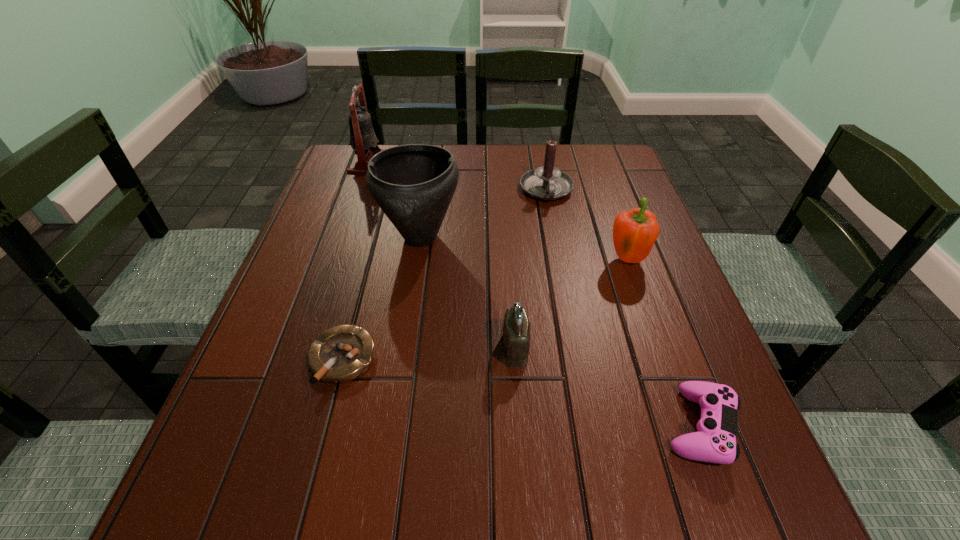
In order to click on bell in this screenshot , I will do `click(363, 140)`.

This screenshot has width=960, height=540. Find the location of `urn`. urn is located at coordinates (413, 184).

At what (x,y) coordinates should I click in order to perform the action: click on pepper. Please return your answer as a coordinate pair (x, y). The image size is (960, 540). Looking at the image, I should click on (635, 231).

Where is `the fifth object from left to right`? This screenshot has width=960, height=540. the fifth object from left to right is located at coordinates (547, 182).

This screenshot has width=960, height=540. What are the coordinates of `the third shortest object` in the screenshot? It's located at coord(516,328).

Where is `the fourth object from left to right`? the fourth object from left to right is located at coordinates (516, 328).

Identify the location of the sixth tallest object. tap(715, 442).

At what (x,y) coordinates should I click in order to perform the action: click on the shortest object. Please return your answer as a coordinate pair (x, y). Image resolution: width=960 pixels, height=540 pixels. Looking at the image, I should click on (343, 353).

Where is `vacant space situated 0.050m on the front of the bell`? This screenshot has height=540, width=960. vacant space situated 0.050m on the front of the bell is located at coordinates (360, 185).

At what (x,y) coordinates should I click in order to perform the action: click on vacant position located on the back of the urn. Please return your answer as a coordinate pair (x, y). This screenshot has height=540, width=960. Looking at the image, I should click on tap(432, 158).